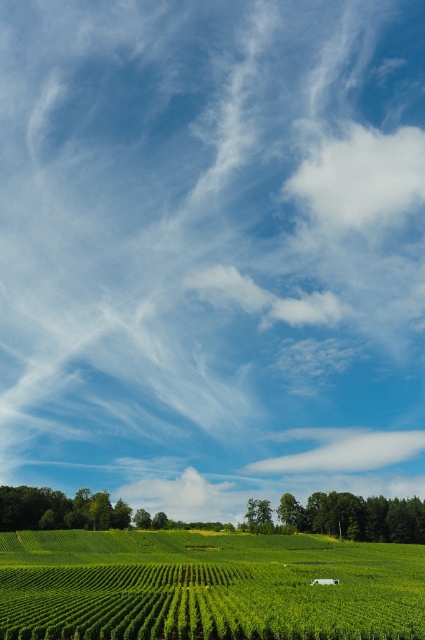
Question: Does green leafy field at lower center have a larger size compared to white fluffy cloud at upper center?

Choices:
 (A) no
 (B) yes

Answer: (B)

Question: Considering the real-world distances, which object is closest to the white fluffy cloud at center?

Choices:
 (A) white fluffy cloud at upper center
 (B) green leafy field at lower center
 (C) white cotton cloud at upper center

Answer: (C)

Question: Which of the following is the farthest from the observer?

Choices:
 (A) green leafy field at lower center
 (B) white cotton cloud at upper center
 (C) white fluffy cloud at upper center

Answer: (C)

Question: Which object is closer to the camera taking this photo?

Choices:
 (A) green leafy field at lower center
 (B) white fluffy cloud at center
 (C) white cotton cloud at upper center
 (D) green leafy trees at center

Answer: (A)

Question: Does white fluffy cloud at upper center have a smaller size compared to green leafy trees at center?

Choices:
 (A) no
 (B) yes

Answer: (A)

Question: Can you confirm if green leafy field at lower center is positioned to the right of green leafy trees at center?

Choices:
 (A) no
 (B) yes

Answer: (A)